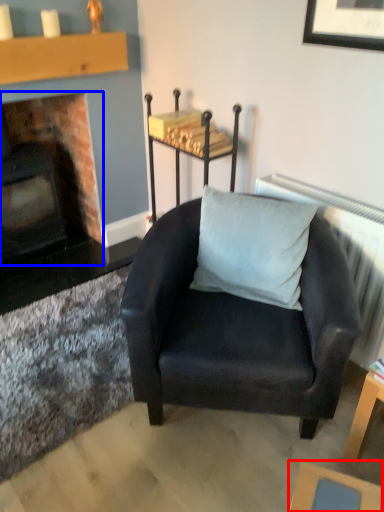
Question: Among these objects, which one is nearest to the camera, table (highlighted by a red box) or fireplace (highlighted by a blue box)?

Choices:
 (A) table
 (B) fireplace

Answer: (A)